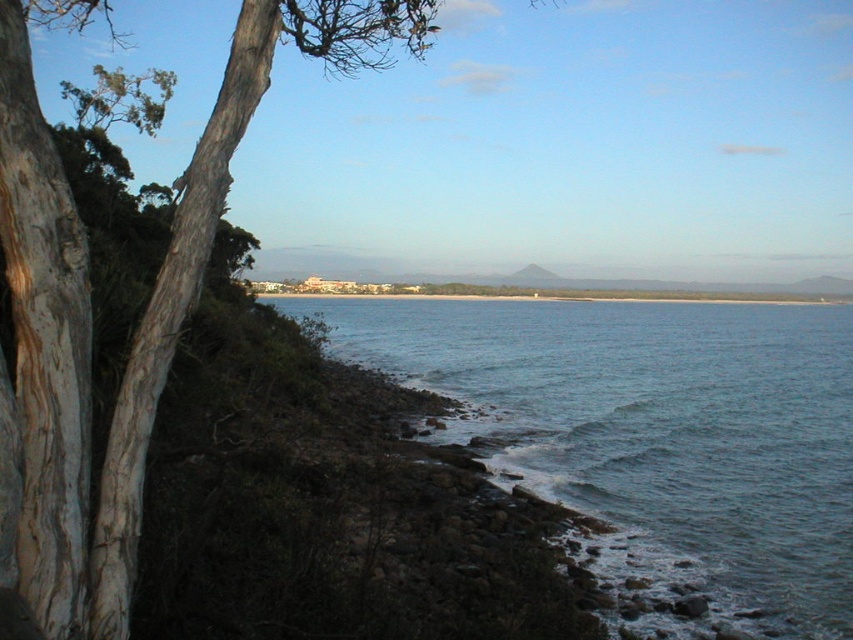
Can you confirm if blue water at lower right is positioned to the right of smooth bark tree at left?

Indeed, blue water at lower right is positioned on the right side of smooth bark tree at left.

Which is behind, point (807, 592) or point (26, 6)?

The point (807, 592) is more distant.

The width and height of the screenshot is (853, 640). Identify the location of blue water at lower right. (653, 429).